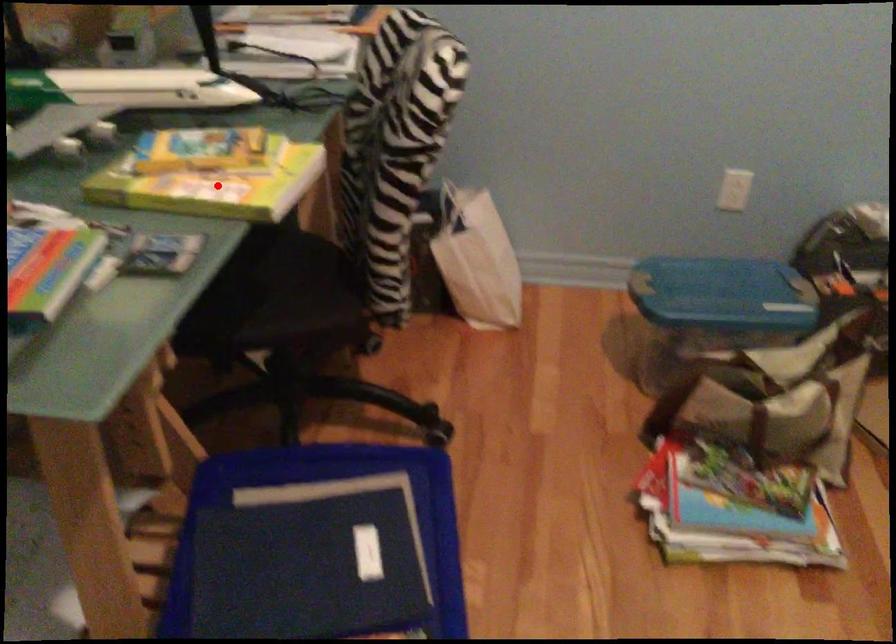
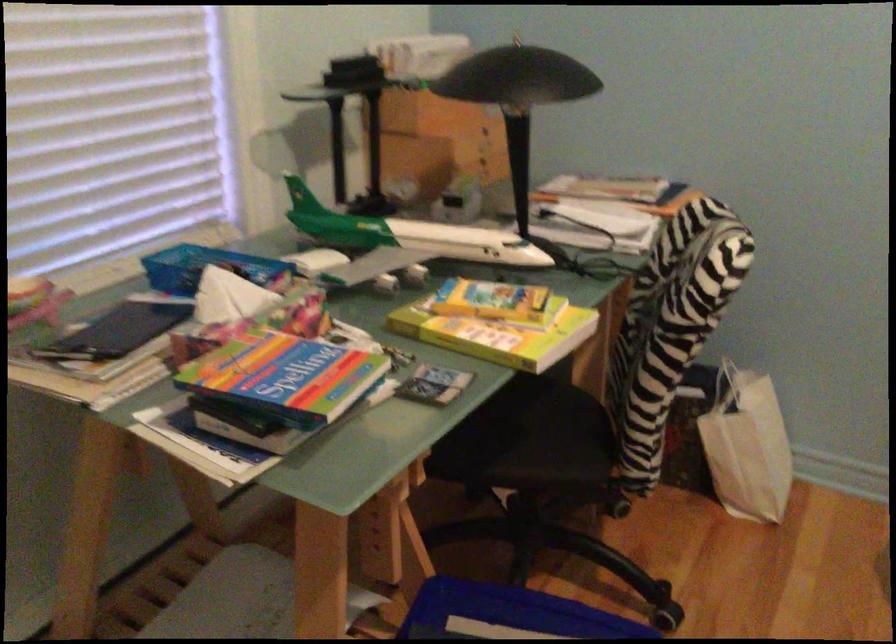
Find the pixel in the second image that matches the highlighted location in the first image.

(497, 330)